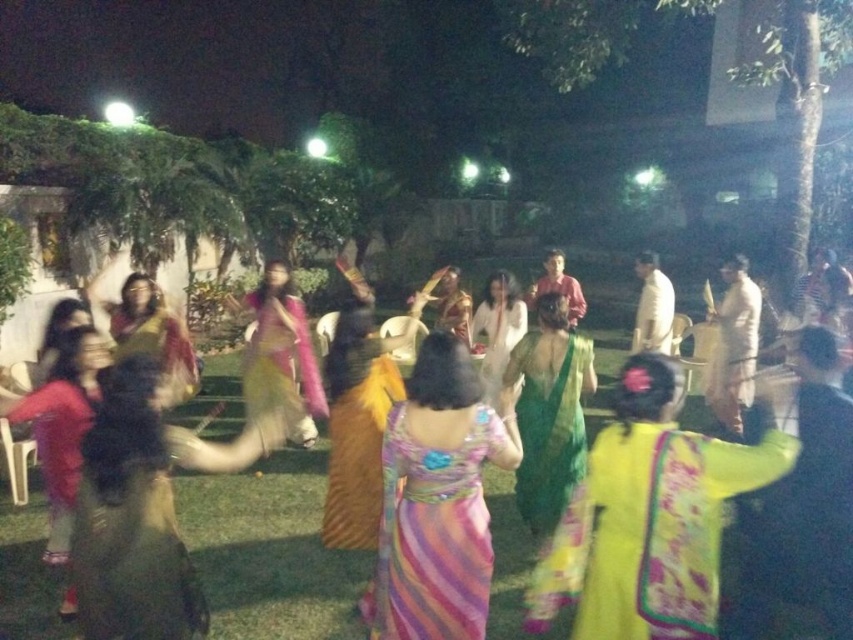
Question: Does white silk saree at center appear on the left side of matte pink shirt at center?

Choices:
 (A) no
 (B) yes

Answer: (A)

Question: Which of these objects is positioned closest to the shiny yellow saree at center?

Choices:
 (A) silky pink saree at center
 (B) green silk saree at center
 (C) multicolored satin dress at center
 (D) white silk shirt at center

Answer: (C)

Question: Is multicolored silk saree at center further to the viewer compared to white silk shirt at center?

Choices:
 (A) no
 (B) yes

Answer: (A)

Question: Can you confirm if multicolored satin dress at center is thinner than green silk saree at center?

Choices:
 (A) no
 (B) yes

Answer: (A)

Question: Which point is closer to the camera?

Choices:
 (A) silky pink saree at center
 (B) multicolored satin dress at center
 (C) multicolored silk saree at center

Answer: (B)

Question: Which of these objects is positioned closest to the white silk shirt at center?

Choices:
 (A) multicolored satin dress at center
 (B) silky pink saree at center

Answer: (B)